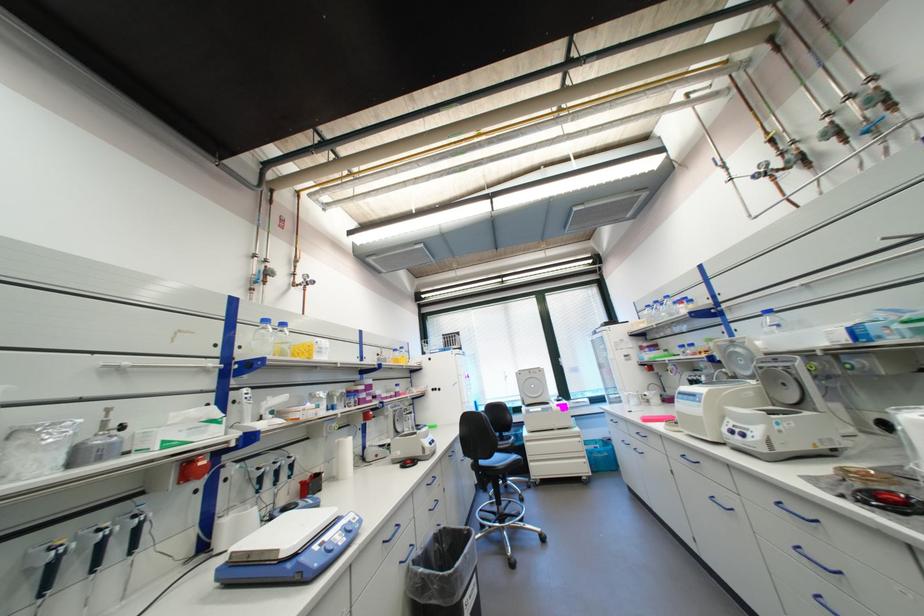
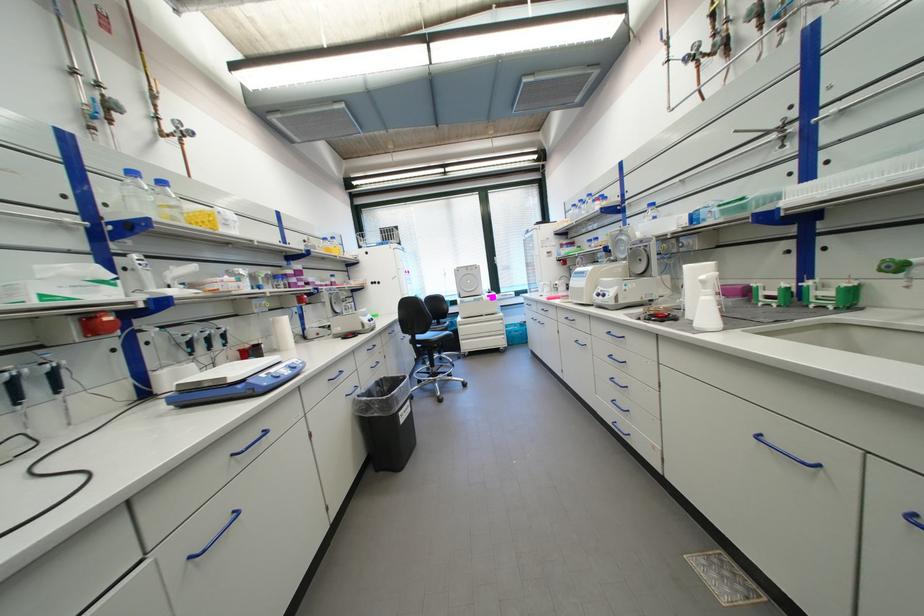
Where in the second image is the point corresponding to [872,503] from the first image?

(655, 321)